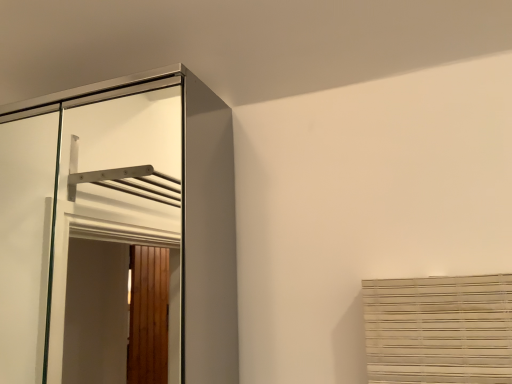
This screenshot has width=512, height=384. What do you see at coordinates (119, 218) in the screenshot?
I see `satin silver locker at left` at bounding box center [119, 218].

Locate an element on the screen. satin silver locker at left is located at coordinates (119, 218).

At what (x,y) coordinates should I click in order to perform the action: click on satin silver locker at left. Please return your answer as a coordinate pair (x, y). The height and width of the screenshot is (384, 512). Looking at the image, I should click on (119, 218).